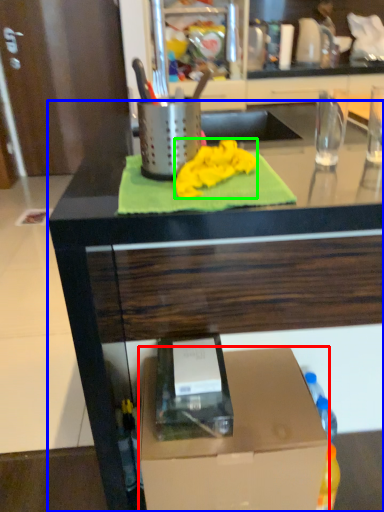
Question: Based on their relative distances, which object is farther from box (highlighted by a red box)? Choose from countertop (highlighted by a blue box) and cloth (highlighted by a green box).

Choices:
 (A) countertop
 (B) cloth

Answer: (B)